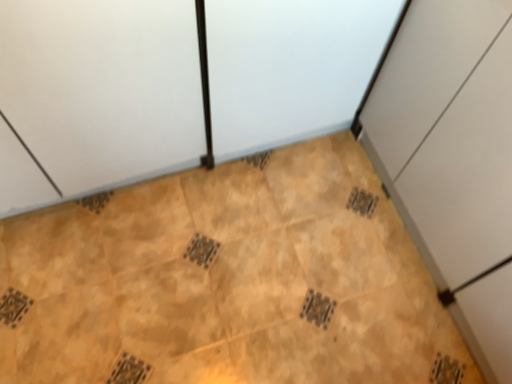
Question: Would you consider white matte cabinet at right to be distant from brown textured tile at center?

Choices:
 (A) no
 (B) yes

Answer: (A)

Question: Considering the relative sizes of white matte cabinet at right and brown textured tile at center in the image provided, is white matte cabinet at right smaller than brown textured tile at center?

Choices:
 (A) no
 (B) yes

Answer: (A)

Question: Is the position of white matte cabinet at right more distant than that of brown textured tile at center?

Choices:
 (A) no
 (B) yes

Answer: (A)

Question: Is white matte cabinet at right located outside brown textured tile at center?

Choices:
 (A) yes
 (B) no

Answer: (A)

Question: Is brown textured tile at center at the back of white matte cabinet at right?

Choices:
 (A) yes
 (B) no

Answer: (B)

Question: Could brown textured tile at center be considered to be inside white matte cabinet at right?

Choices:
 (A) yes
 (B) no

Answer: (B)

Question: Is brown textured tile at center touching white matte cabinet at right?

Choices:
 (A) no
 (B) yes

Answer: (A)

Question: Does brown textured tile at center contain white matte cabinet at right?

Choices:
 (A) yes
 (B) no

Answer: (B)

Question: From the image's perspective, is brown textured tile at center on white matte cabinet at right?

Choices:
 (A) yes
 (B) no

Answer: (B)

Question: Does brown textured tile at center have a lesser width compared to white matte cabinet at right?

Choices:
 (A) yes
 (B) no

Answer: (B)

Question: Can you confirm if brown textured tile at center is bigger than white matte cabinet at right?

Choices:
 (A) yes
 (B) no

Answer: (B)

Question: Considering the relative sizes of brown textured tile at center and white matte cabinet at right in the image provided, is brown textured tile at center wider than white matte cabinet at right?

Choices:
 (A) yes
 (B) no

Answer: (A)

Question: Considering the positions of white matte cabinet at right and brown textured tile at center in the image, is white matte cabinet at right wider or thinner than brown textured tile at center?

Choices:
 (A) thin
 (B) wide

Answer: (A)